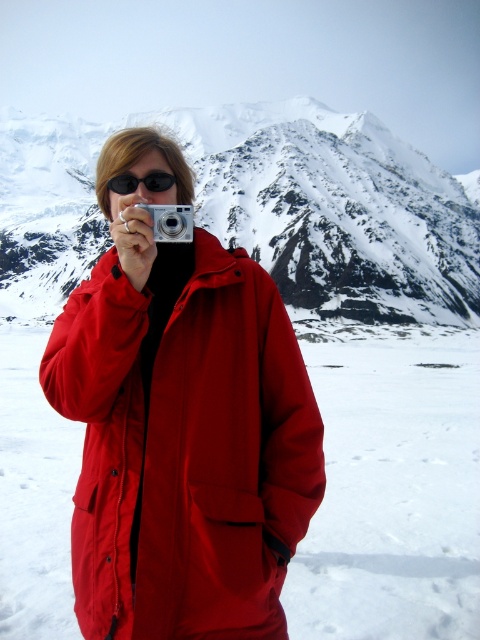
You are standing in the snowy landscape and want to take a photo of the mountains. The camera you have can focus on objects up to 50 meters away. Is the point where you need to focus, located at coordinates point (196, 282), within the camera focus range?

The point (196, 282) is 46.32 meters from the viewer, which is within the camera focus range of up to 50 meters. Yes, the camera can focus on that point.

You are a photographer trying to take a picture of the mountain range in the snowy landscape. You have a silver metallic camera at center and black plastic goggles at center. Which object is closer to you when you look through the camera viewfinder?

The silver metallic camera at center is closer to the viewer than the black plastic goggles at center, so when looking through the camera viewfinder, the silver metallic camera at center would appear closer.

You are a photographer trying to capture the mountain range in the background. You notice the matte red jacket at center and the silver metallic camera at center in your frame. If you want to ensure both objects are fully visible in your shot, which object should you prioritize keeping closer to the edge of the frame?

The matte red jacket at center might be wider than the silver metallic camera at center, so you should prioritize keeping the matte red jacket at center closer to the edge of the frame to ensure both fit within the shot.